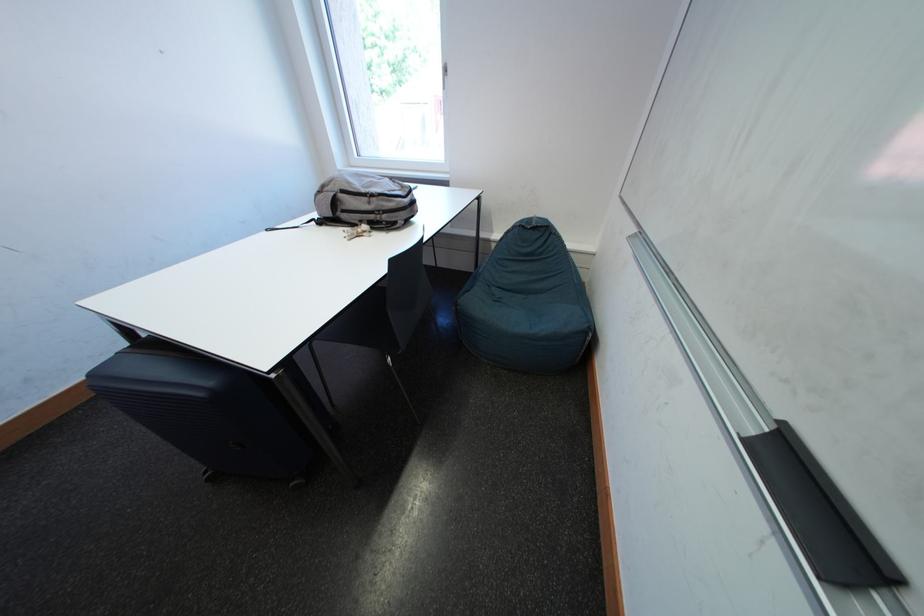
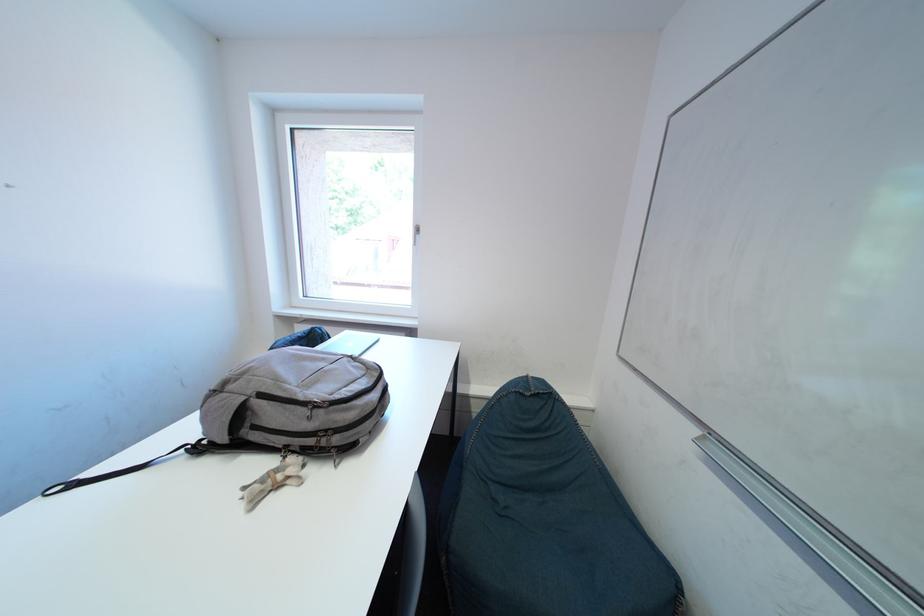
What movement of the cameraman would produce the second image?

The cameraman moved toward left, forward.